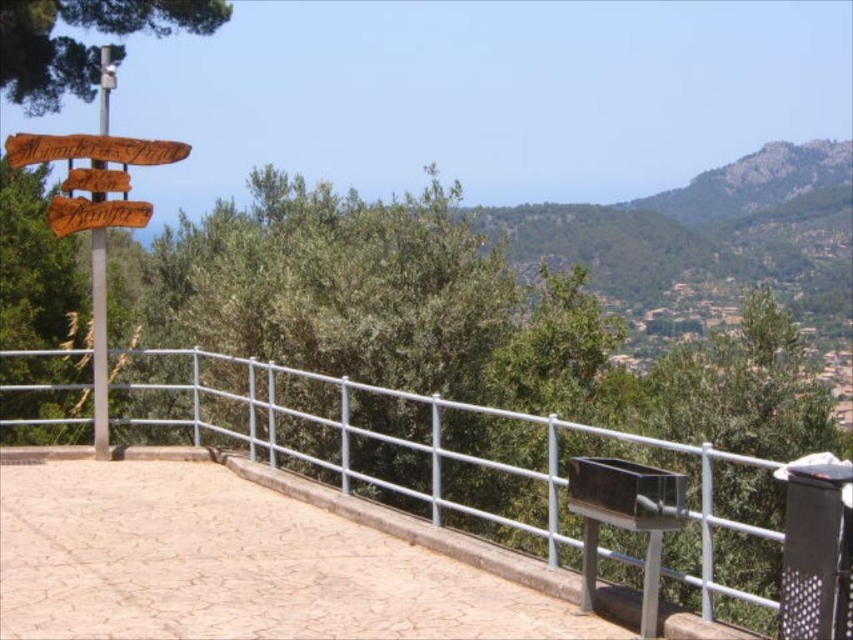
Which is above, brown textured stone at center or silver metallic fence at center?

silver metallic fence at center is higher up.

Who is more forward, (x=339, y=604) or (x=264, y=364)?

Point (x=339, y=604)

This screenshot has width=853, height=640. Find the location of `brown textured stone at center`. brown textured stone at center is located at coordinates (234, 564).

Based on the photo, is brown textured stone at center thinner than wooden sign at upper left?

No.

Identify the location of brown textured stone at center. This screenshot has height=640, width=853. (234, 564).

Locate an element on the screen. brown textured stone at center is located at coordinates (234, 564).

Can you confirm if silver metallic fence at center is wider than wooden sign at upper left?

Yes, silver metallic fence at center is wider than wooden sign at upper left.

Which is in front, point (706, 584) or point (77, 173)?

Point (706, 584) is more forward.

Which is in front, point (437, 419) or point (129, 205)?

Point (437, 419)

This screenshot has width=853, height=640. What are the coordinates of `silver metallic fence at center` in the screenshot? It's located at (466, 458).